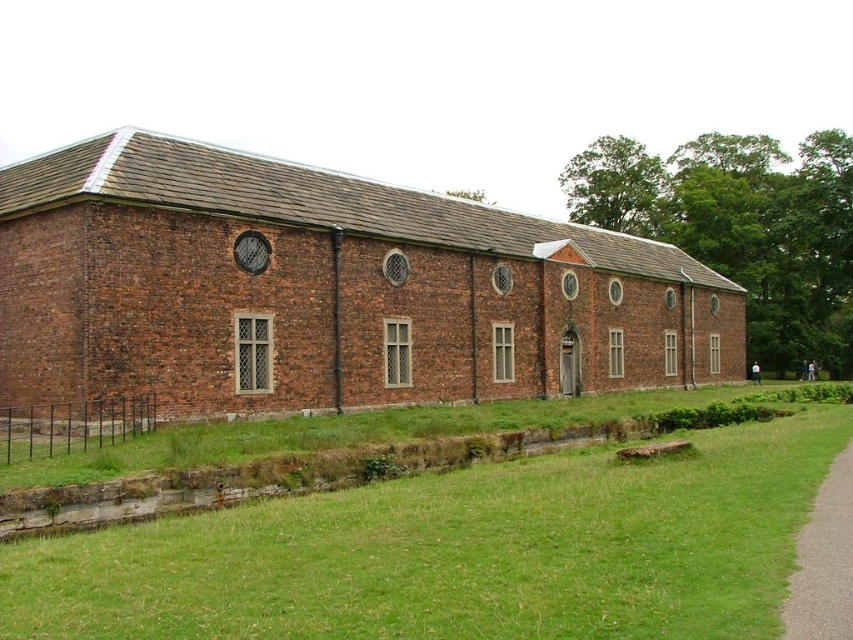
Question: Is brown brick building at center positioned at the back of gray asphalt path at lower right?

Choices:
 (A) yes
 (B) no

Answer: (A)

Question: Does brown brick building at center appear over green grass at lower center?

Choices:
 (A) no
 (B) yes

Answer: (B)

Question: Among these objects, which one is farthest from the camera?

Choices:
 (A) brown brick building at center
 (B) green grass at lower center

Answer: (A)

Question: Among these objects, which one is farthest from the camera?

Choices:
 (A) green grass at lower center
 (B) brown brick building at center

Answer: (B)

Question: Is brown brick building at center in front of gray asphalt path at lower right?

Choices:
 (A) no
 (B) yes

Answer: (A)

Question: Which point is closer to the camera?

Choices:
 (A) (653, 355)
 (B) (833, 474)
 (C) (363, 552)

Answer: (C)